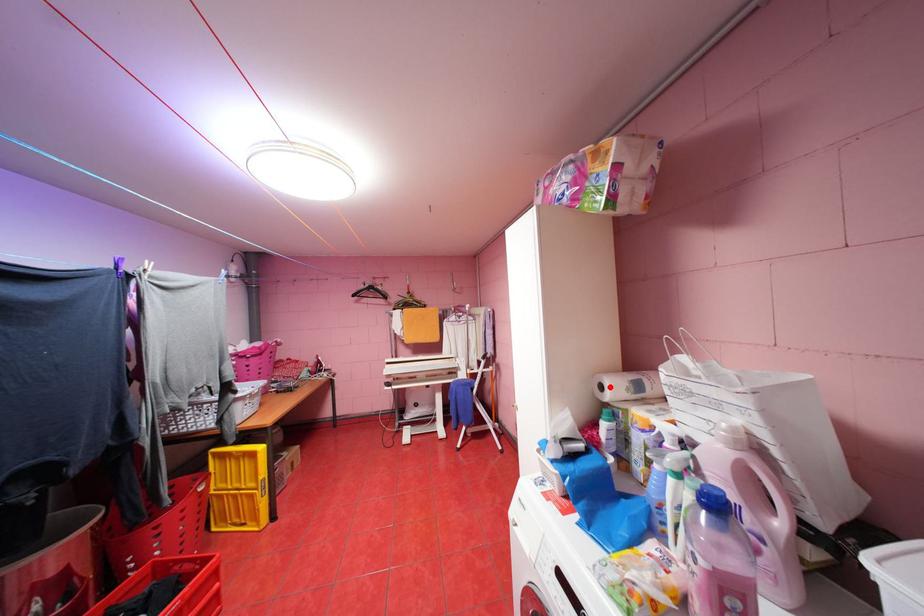
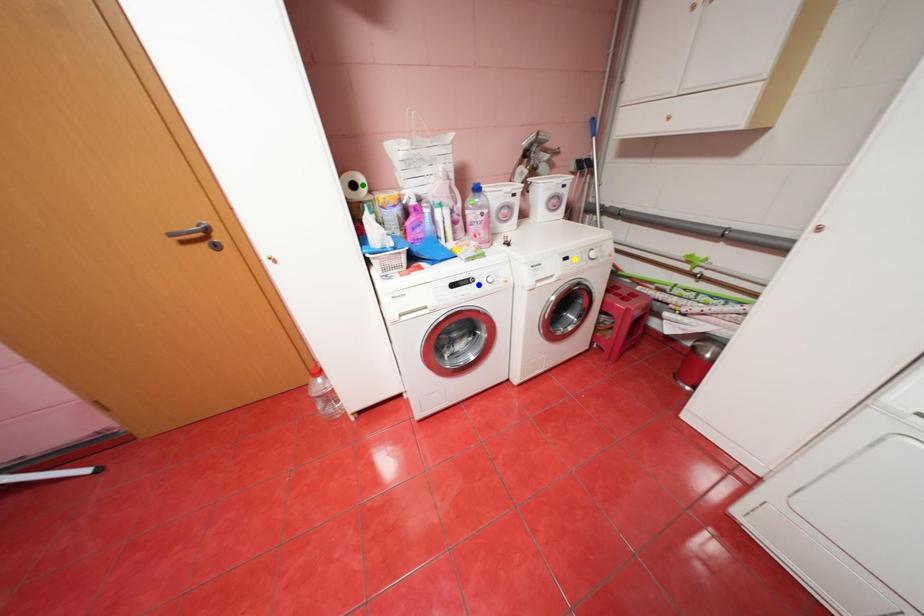
Question: I am providing you with two images of the same scene from different viewpoints. A red point is marked on the first image. You are given multiple points on the second image. Which spot in image 2 lines up with the point in image 1?

Choices:
 (A) blue point
 (B) green point
 (C) yellow point

Answer: (B)